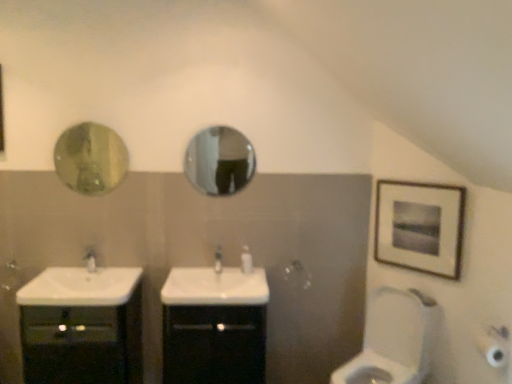
Describe the element at coordinates (217, 284) in the screenshot. I see `white glossy sink at center, the 2th sink positioned from the left` at that location.

In order to face white glossy tap at center, marked as the 1th tap in a right-to-left arrangement, should I rotate leftwards or rightwards?

To face it directly, rotate left by 5.138 degrees.

Measure the distance between point (89,292) and camera.

They are 7.92 feet apart.

The height and width of the screenshot is (384, 512). Describe the element at coordinates (81, 286) in the screenshot. I see `white glossy sink at lower left, which appears as the first sink when viewed from the left` at that location.

What do you see at coordinates (296, 274) in the screenshot? The width and height of the screenshot is (512, 384). I see `matte silver towel bar at center` at bounding box center [296, 274].

The height and width of the screenshot is (384, 512). What do you see at coordinates (246, 260) in the screenshot?
I see `white glossy soap dispenser at center` at bounding box center [246, 260].

This screenshot has width=512, height=384. What do you see at coordinates (214, 326) in the screenshot?
I see `black glossy cabinet at center, the first bathroom cabinet from the right` at bounding box center [214, 326].

What are the coordinates of `white glossy sink at center, the 2th sink positioned from the left` in the screenshot? It's located at (217, 284).

From their relative heights in the image, would you say white glossy soap dispenser at center is taller or shorter than white glossy tap at center, the second tap viewed from the right?

white glossy soap dispenser at center is taller than white glossy tap at center, the second tap viewed from the right.

Which is behind, point (242, 267) or point (86, 254)?

The point (86, 254) is farther.

From the image's perspective, which is above, white glossy soap dispenser at center or white glossy tap at center, the second tap viewed from the right?

white glossy tap at center, the second tap viewed from the right, is shown above in the image.

Is white glossy soap dispenser at center smaller than white glossy tap at center, positioned as the first tap in left-to-right order?

Yes.

Looking at this image, from the image's perspective, does black glossy cabinet at center, the second bathroom cabinet from the left, appear lower than green glass mirror at upper left, which ranks as the 2th mirror in right-to-left order?

Indeed, from the image's perspective, black glossy cabinet at center, the second bathroom cabinet from the left, is shown beneath green glass mirror at upper left, which ranks as the 2th mirror in right-to-left order.

I want to click on bathroom cabinet that is the 1st object located in front of the green glass mirror at upper left, which ranks as the 2th mirror in right-to-left order, so click(x=214, y=326).

Is the depth of black glossy cabinet at center, the second bathroom cabinet from the left, greater than that of green glass mirror at upper left, which ranks as the 2th mirror in right-to-left order?

No, black glossy cabinet at center, the second bathroom cabinet from the left, is in front of green glass mirror at upper left, which ranks as the 2th mirror in right-to-left order.

Is white glossy toilet at lower right wider or thinner than white glossy tap at center, marked as the 1th tap in a right-to-left arrangement?

white glossy toilet at lower right is wider than white glossy tap at center, marked as the 1th tap in a right-to-left arrangement.

Does point (400, 317) appear closer or farther from the camera than point (220, 253)?

Point (400, 317) appears to be closer to the viewer than point (220, 253).

From a real-world perspective, is white glossy toilet at lower right physically below white glossy tap at center, marked as the 1th tap in a right-to-left arrangement?

Yes, from a real-world perspective, white glossy toilet at lower right is beneath white glossy tap at center, marked as the 1th tap in a right-to-left arrangement.

Based on the photo, from the image's perspective, is white glossy toilet at lower right on white glossy tap at center, marked as the 1th tap in a right-to-left arrangement?

No, from the image's perspective, white glossy toilet at lower right is not over white glossy tap at center, marked as the 1th tap in a right-to-left arrangement.

Which object is wider, matte silver towel bar at center or white glossy sink at center, the 2th sink positioned from the left?

Wider between the two is white glossy sink at center, the 2th sink positioned from the left.

Are matte silver towel bar at center and white glossy sink at center, the 2th sink positioned from the left, making contact?

No, matte silver towel bar at center is not in contact with white glossy sink at center, the 2th sink positioned from the left.

Can white glossy sink at center, the 2th sink positioned from the left, be found inside matte silver towel bar at center?

No.

Consider the image. In terms of height, does matte silver towel bar at center look taller or shorter compared to white glossy sink at center, the 2th sink positioned from the left?

Clearly, matte silver towel bar at center is taller compared to white glossy sink at center, the 2th sink positioned from the left.

Is white glossy soap dispenser at center positioned with its back to white glossy toilet at lower right?

No, white glossy soap dispenser at center is not facing the opposite direction of white glossy toilet at lower right.

Considering the sizes of white glossy soap dispenser at center and white glossy toilet at lower right in the image, is white glossy soap dispenser at center taller or shorter than white glossy toilet at lower right?

Clearly, white glossy soap dispenser at center is shorter compared to white glossy toilet at lower right.

Can you tell me how much white glossy soap dispenser at center and white glossy toilet at lower right differ in facing direction?

The angle between the facing direction of white glossy soap dispenser at center and the facing direction of white glossy toilet at lower right is 50.7 degrees.

Is white glossy soap dispenser at center in contact with white glossy toilet at lower right?

No, white glossy soap dispenser at center is not next to white glossy toilet at lower right.

Can you confirm if white glossy sink at center, the 2th sink positioned from the left, is taller than white glossy soap dispenser at center?

No.

Is white glossy sink at center, positioned as the first sink in right-to-left order, wider or thinner than white glossy soap dispenser at center?

Considering their sizes, white glossy sink at center, positioned as the first sink in right-to-left order, looks broader than white glossy soap dispenser at center.

From the picture: How many degrees apart are the facing directions of white glossy sink at center, the 2th sink positioned from the left, and white glossy soap dispenser at center?

0.0142 degrees.

Is white glossy sink at center, the 2th sink positioned from the left, facing away from white glossy soap dispenser at center?

No.

Would you say white glossy soap dispenser at center is a long distance from matte silver towel bar at center?

No, there isn't a large distance between white glossy soap dispenser at center and matte silver towel bar at center.

Which object is further away from the camera taking this photo, white glossy soap dispenser at center or matte silver towel bar at center?

matte silver towel bar at center is more distant.

Would you say white glossy soap dispenser at center contains matte silver towel bar at center?

That's incorrect, matte silver towel bar at center is not inside white glossy soap dispenser at center.

Does white glossy soap dispenser at center have a smaller size compared to matte silver towel bar at center?

No, white glossy soap dispenser at center is not smaller than matte silver towel bar at center.

Starting from the white glossy soap dispenser at center, which tap is the 2nd one in front? Please provide its 2D coordinates.

[(90, 259)]

Find the location of `mirror on the left of black glossy cabinet at center, the first bathroom cabinet from the right`. mirror on the left of black glossy cabinet at center, the first bathroom cabinet from the right is located at coordinates (90, 159).

Based on their spatial positions, is matte silver towel bar at center or white glossy soap dispenser at center closer to black glossy cabinet at lower left, the 1th bathroom cabinet from the left?

white glossy soap dispenser at center.

Looking at the image, which one is located further to white glossy sink at center, positioned as the first sink in right-to-left order, white glossy sink at lower left, the second sink in the right-to-left sequence, or white glossy soap dispenser at center?

Among the two, white glossy sink at lower left, the second sink in the right-to-left sequence, is located further to white glossy sink at center, positioned as the first sink in right-to-left order.

Estimate the real-world distances between objects in this image. Which object is further from black glossy cabinet at center, the second bathroom cabinet from the left, white glossy tap at center, which is counted as the 2th tap, starting from the left, or white glossy tap at center, positioned as the first tap in left-to-right order?

white glossy tap at center, positioned as the first tap in left-to-right order, is positioned further to the anchor black glossy cabinet at center, the second bathroom cabinet from the left.

Based on their spatial positions, is glossy metallic mirror at center, which appears as the 2th mirror when viewed from the left, or white glossy sink at lower left, which appears as the first sink when viewed from the left, closer to white glossy sink at center, the 2th sink positioned from the left?

white glossy sink at lower left, which appears as the first sink when viewed from the left, lies closer to white glossy sink at center, the 2th sink positioned from the left, than the other object.

Estimate the real-world distances between objects in this image. Which object is closer to white glossy soap dispenser at center, white glossy tap at center, positioned as the first tap in left-to-right order, or white glossy tap at center, marked as the 1th tap in a right-to-left arrangement?

The object closer to white glossy soap dispenser at center is white glossy tap at center, marked as the 1th tap in a right-to-left arrangement.

From the picture: From the image, which object appears to be farther from wooden framed artwork at upper right, matte silver towel bar at center or black glossy cabinet at center, the second bathroom cabinet from the left?

black glossy cabinet at center, the second bathroom cabinet from the left.

Which object lies nearer to the anchor point green glass mirror at upper left, which ranks as the 2th mirror in right-to-left order, matte silver towel bar at center or white glossy tap at center, which is counted as the 2th tap, starting from the left?

white glossy tap at center, which is counted as the 2th tap, starting from the left, is positioned closer to the anchor green glass mirror at upper left, which ranks as the 2th mirror in right-to-left order.

Looking at this image, based on their spatial positions, is white glossy sink at center, the 2th sink positioned from the left, or black glossy cabinet at center, the second bathroom cabinet from the left, further from white glossy sink at lower left, the second sink in the right-to-left sequence?

black glossy cabinet at center, the second bathroom cabinet from the left, is further to white glossy sink at lower left, the second sink in the right-to-left sequence.

Where is `sink between black glossy cabinet at center, the second bathroom cabinet from the left, and wooden framed artwork at upper right from left to right`? The width and height of the screenshot is (512, 384). sink between black glossy cabinet at center, the second bathroom cabinet from the left, and wooden framed artwork at upper right from left to right is located at coordinates (217, 284).

Find the location of `towel bar situated between white glossy tap at center, which is counted as the 2th tap, starting from the left, and wooden framed artwork at upper right from left to right`. towel bar situated between white glossy tap at center, which is counted as the 2th tap, starting from the left, and wooden framed artwork at upper right from left to right is located at coordinates (296, 274).

I want to click on gray between white glossy tap at center, the second tap viewed from the right, and wooden framed artwork at upper right, in the horizontal direction, so click(x=394, y=340).

At what (x,y) coordinates should I click in order to perform the action: click on gray located between white glossy soap dispenser at center and wooden framed artwork at upper right in the left-right direction. Please return your answer as a coordinate pair (x, y). Looking at the image, I should click on (394, 340).